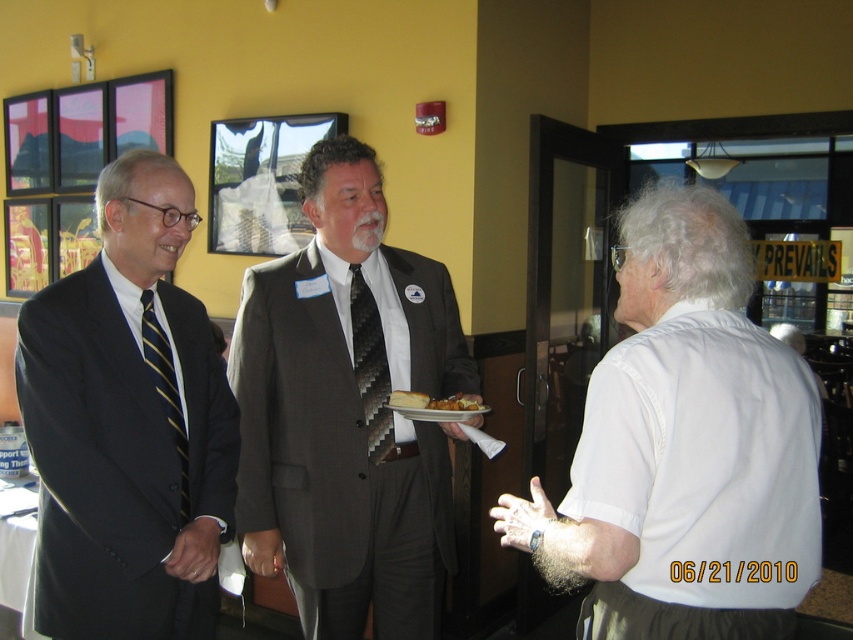
Consider the image. You are a photographer at a formal event. You need to capture a photo of the golden brown bread at center and the striped silk tie at left. Which object should you focus on first to ensure both are in frame without moving the camera?

You should focus on the striped silk tie at left first since it is positioned to the left of the golden brown bread at center, ensuring both are within the camera frame when starting from the left side.

You are a photographer at this event and want to ensure that both the white cotton shirt at right and the gray suit at center are visible in your photo. Given their heights, which one might you need to adjust your camera angle for to capture both properly?

The white cotton shirt at right has a lesser height compared to gray suit at center. To capture both properly, you might need to lower your camera angle slightly to ensure the taller gray suit at center doesn